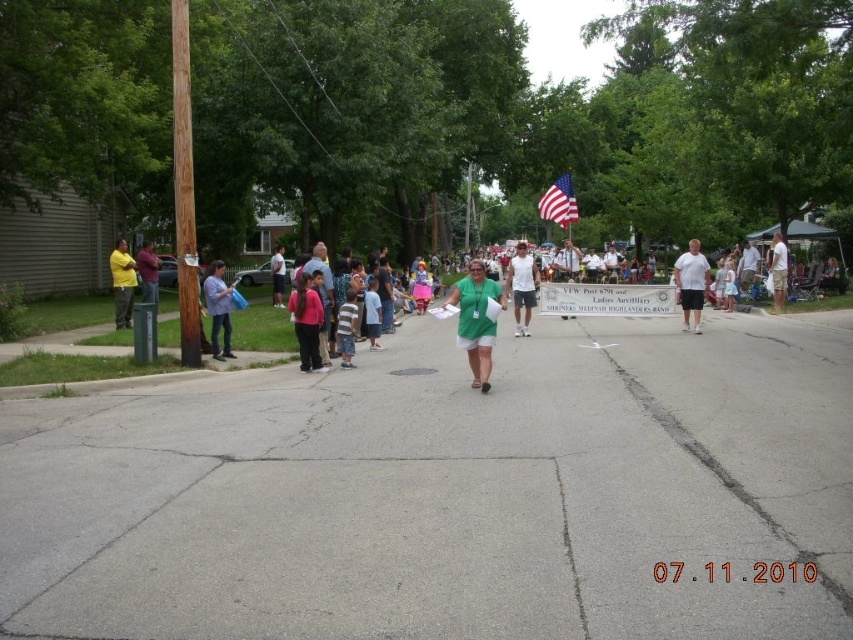
Is white cotton t-shirt at center bigger than pink fabric shirt at center?

Incorrect, white cotton t-shirt at center is not larger than pink fabric shirt at center.

At what (x,y) coordinates should I click in order to perform the action: click on white cotton t-shirt at center. Please return your answer as a coordinate pair (x, y). Looking at the image, I should click on (691, 284).

This screenshot has height=640, width=853. What are the coordinates of `white cotton t-shirt at center` in the screenshot? It's located at (691, 284).

Based on the photo, does yellow shirt at left appear on the right side of pink fabric shirt at center?

Incorrect, yellow shirt at left is not on the right side of pink fabric shirt at center.

Is point (131, 262) positioned in front of point (277, 284)?

Yes, point (131, 262) is in front of point (277, 284).

Identify the location of yellow shirt at left. (122, 282).

What are the coordinates of `yellow shirt at left` in the screenshot? It's located at (122, 282).

Does white cotton t-shirt at center have a greater width compared to matte yellow shirt at left?

Yes.

Is point (699, 304) positioned after point (142, 300)?

No, it is in front of (142, 300).

Image resolution: width=853 pixels, height=640 pixels. I want to click on white cotton t-shirt at center, so click(691, 284).